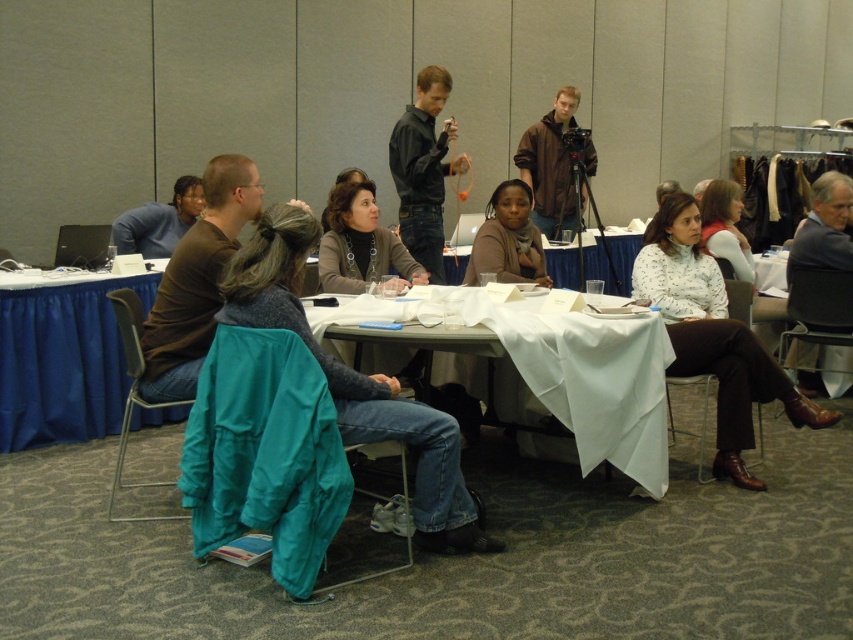
You are attending a meeting and notice two items of clothing in the room. The brown leather jacket at upper center and the brown sweater at center. Which one is positioned higher up in the image?

The brown leather jacket at upper center is positioned higher up in the image than the brown sweater at center.

You are standing in the room and want to place a new object on the blue fabric table at left. According to the coordinates provided, where exactly should you place it?

The blue fabric table at left is located at point coordinates of (62,362).

You are standing at the point labeled as point (119, 248) in the room. There is a person sitting on a chair with a teal jacket behind you. Can you see the other point labeled point (566, 198) from your current position?

Since point (566, 198) is behind point (119, 248), you cannot see the other point labeled point (566, 198) from your current position.